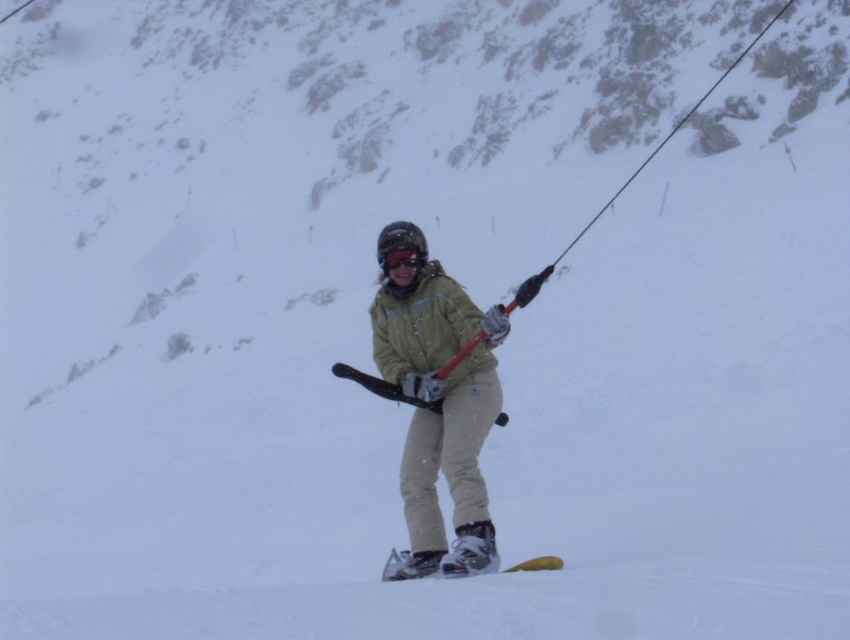
Is point (372, 388) positioned in front of point (381, 253)?

Yes, it is.

Where is `matte black ski at center`? The width and height of the screenshot is (850, 640). matte black ski at center is located at coordinates (381, 387).

Where is `matte black ski at center`? The width and height of the screenshot is (850, 640). matte black ski at center is located at coordinates (381, 387).

Where is `matte black ski at center`? matte black ski at center is located at coordinates (381, 387).

Who is positioned more to the left, matte yellow jacket at center or matte black ski at center?

From the viewer's perspective, matte black ski at center appears more on the left side.

Does matte yellow jacket at center appear on the left side of matte black ski at center?

No, matte yellow jacket at center is not to the left of matte black ski at center.

Is point (455, 502) positioned after point (382, 388)?

No, (455, 502) is closer to viewer.

Where is `matte yellow jacket at center`? The image size is (850, 640). matte yellow jacket at center is located at coordinates (438, 412).

From the picture: Is matte black goggles at center positioned behind white plastic ski at lower center?

Yes, it is.

Based on the photo, does matte black goggles at center have a lesser height compared to white plastic ski at lower center?

No.

Where is `matte black goggles at center`? The height and width of the screenshot is (640, 850). matte black goggles at center is located at coordinates (401, 256).